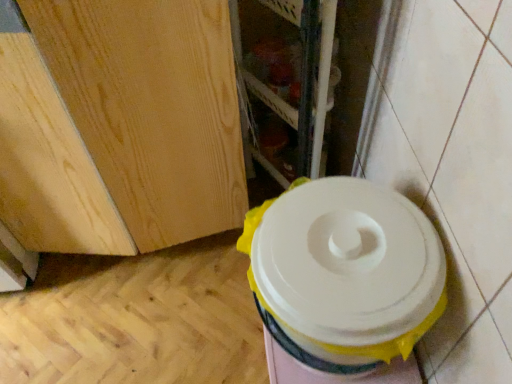
Question: Based on their sizes in the image, would you say wooden shelf at center is bigger or smaller than white plastic toilet at lower right?

Choices:
 (A) big
 (B) small

Answer: (A)

Question: Considering the relative positions of wooden shelf at center and white plastic toilet at lower right in the image provided, is wooden shelf at center to the left or to the right of white plastic toilet at lower right?

Choices:
 (A) left
 (B) right

Answer: (A)

Question: Is wooden shelf at center wider or thinner than white plastic toilet at lower right?

Choices:
 (A) wide
 (B) thin

Answer: (B)

Question: Is point (359, 347) positioned closer to the camera than point (311, 160)?

Choices:
 (A) closer
 (B) farther

Answer: (A)

Question: Considering their positions, is white plastic toilet at lower right located in front of or behind wooden shelf at center?

Choices:
 (A) behind
 (B) front

Answer: (B)

Question: Based on their sizes in the image, would you say white plastic toilet at lower right is bigger or smaller than wooden shelf at center?

Choices:
 (A) small
 (B) big

Answer: (A)

Question: Would you say white plastic toilet at lower right is to the left or to the right of wooden shelf at center in the picture?

Choices:
 (A) left
 (B) right

Answer: (B)